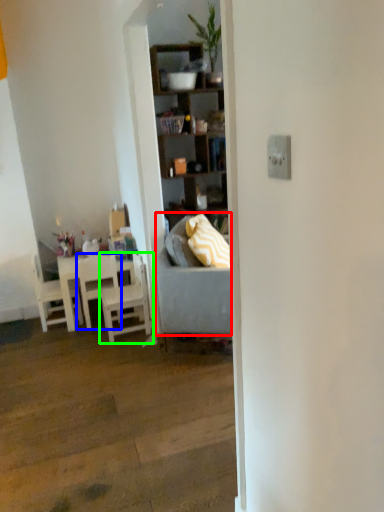
Question: Considering the real-world distances, which object is closest to studio couch (highlighted by a red box)? chair (highlighted by a blue box) or chair (highlighted by a green box).

Choices:
 (A) chair
 (B) chair

Answer: (B)